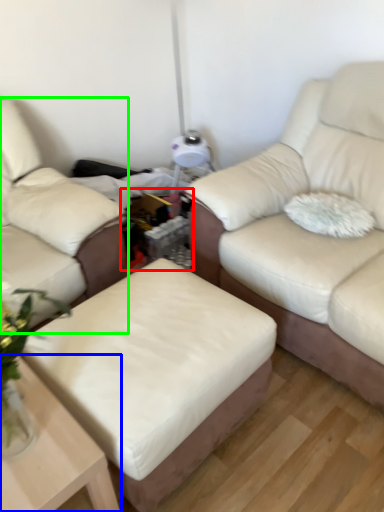
Question: Estimate the real-world distances between objects in this image. Which object is closer to cocktail table (highlighted by a red box), table (highlighted by a blue box) or studio couch (highlighted by a green box)?

Choices:
 (A) table
 (B) studio couch

Answer: (B)